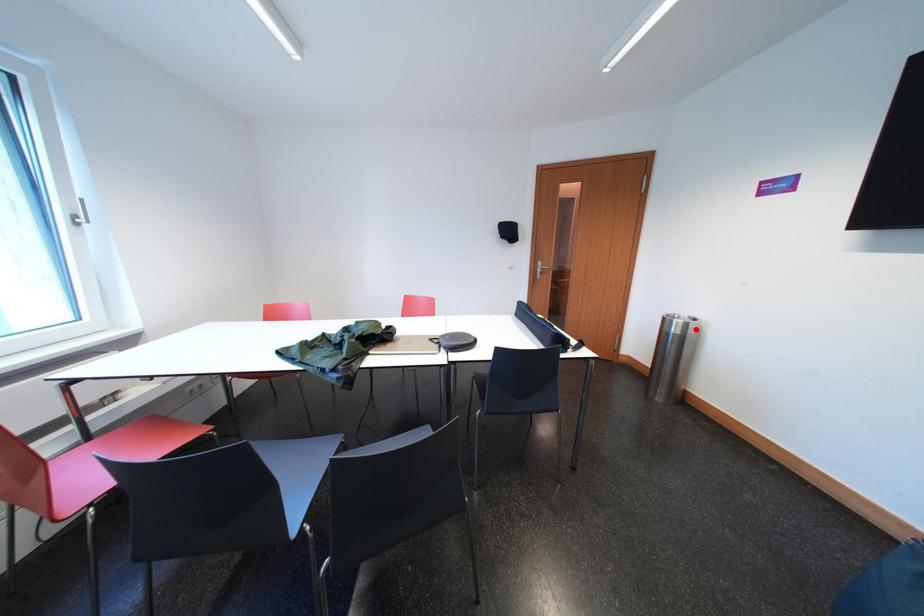
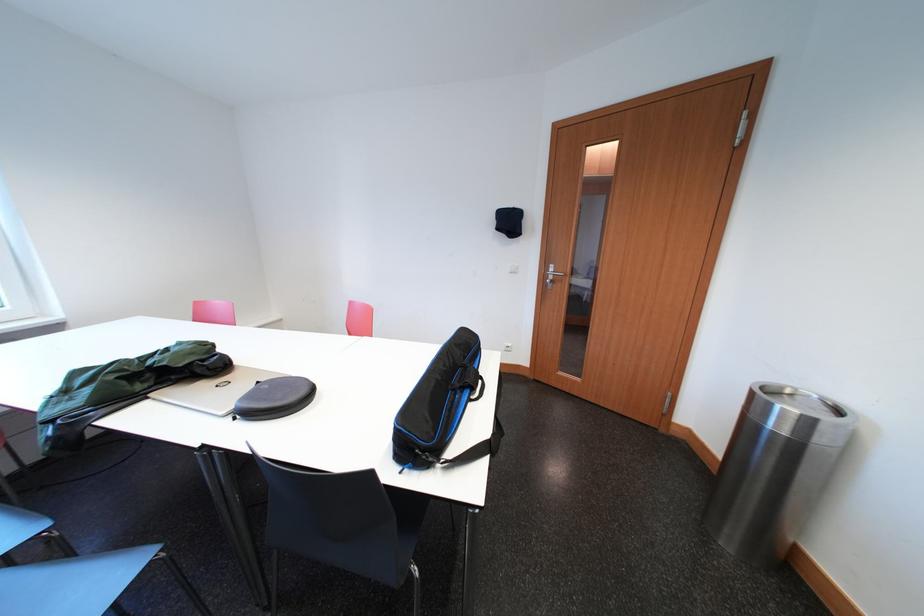
Where in the second image is the point corresponding to the highlighted location from the first image?

(819, 426)